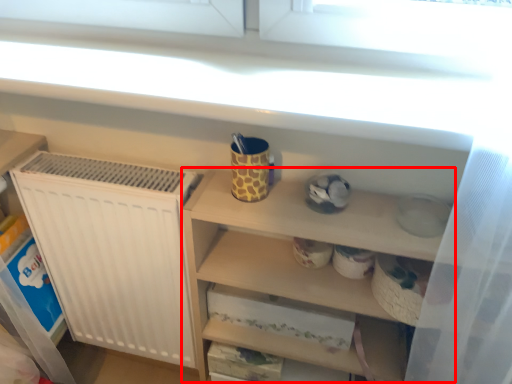
Question: Observing the image, what is the correct spatial positioning of cabinet (annotated by the red box) in reference to mug?

Choices:
 (A) left
 (B) right

Answer: (B)